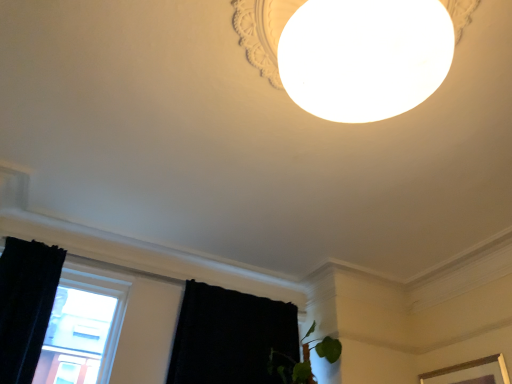
Image resolution: width=512 pixels, height=384 pixels. Describe the element at coordinates (26, 305) in the screenshot. I see `black velvet curtain at left, the first curtain from the left` at that location.

Locate an element on the screen. transparent glass window at lower left is located at coordinates (83, 328).

Is black fabric curtain at lower left, the second curtain positioned from the left, aimed at transparent glass window at lower left?

No, black fabric curtain at lower left, the second curtain positioned from the left, does not turn towards transparent glass window at lower left.

Is black fabric curtain at lower left, the second curtain positioned from the left, in contact with transparent glass window at lower left?

No, black fabric curtain at lower left, the second curtain positioned from the left, is not making contact with transparent glass window at lower left.

Based on the photo, considering the relative positions of black fabric curtain at lower left, the 1th curtain when ordered from right to left, and transparent glass window at lower left in the image provided, is black fabric curtain at lower left, the 1th curtain when ordered from right to left, to the left of transparent glass window at lower left from the viewer's perspective?

No.

Based on the photo, can you tell me how much black fabric curtain at lower left, the 1th curtain when ordered from right to left, and transparent glass window at lower left differ in facing direction?

The angle between the facing direction of black fabric curtain at lower left, the 1th curtain when ordered from right to left, and the facing direction of transparent glass window at lower left is 5.95 degrees.

Considering the positions of objects black velvet curtain at left, the first curtain from the left, and transparent glass window at lower left in the image provided, who is in front, black velvet curtain at left, the first curtain from the left, or transparent glass window at lower left?

black velvet curtain at left, the first curtain from the left, is more forward.

Is black velvet curtain at left, which ranks as the second curtain in right-to-left order, facing away from transparent glass window at lower left?

Yes, black velvet curtain at left, which ranks as the second curtain in right-to-left order, is positioned with its back facing transparent glass window at lower left.

Based on the photo, are black velvet curtain at left, which ranks as the second curtain in right-to-left order, and transparent glass window at lower left making contact?

black velvet curtain at left, which ranks as the second curtain in right-to-left order, and transparent glass window at lower left are clearly separated.

Between black velvet curtain at left, the first curtain from the left, and transparent glass window at lower left, which one has smaller width?

With smaller width is transparent glass window at lower left.

Which object is positioned more to the right, black velvet curtain at left, the first curtain from the left, or black fabric curtain at lower left, the 1th curtain when ordered from right to left?

From the viewer's perspective, black fabric curtain at lower left, the 1th curtain when ordered from right to left, appears more on the right side.

Can you tell me how much black velvet curtain at left, which ranks as the second curtain in right-to-left order, and black fabric curtain at lower left, the second curtain positioned from the left, differ in facing direction?

6.14 degrees separate the facing orientations of black velvet curtain at left, which ranks as the second curtain in right-to-left order, and black fabric curtain at lower left, the second curtain positioned from the left.

Which of these two, black velvet curtain at left, the first curtain from the left, or black fabric curtain at lower left, the second curtain positioned from the left, stands shorter?

black fabric curtain at lower left, the second curtain positioned from the left, is shorter.

What's the angular difference between black fabric curtain at lower left, the second curtain positioned from the left, and black velvet curtain at left, which ranks as the second curtain in right-to-left order,'s facing directions?

black fabric curtain at lower left, the second curtain positioned from the left, and black velvet curtain at left, which ranks as the second curtain in right-to-left order, are facing 6.14 degrees away from each other.

In order to click on curtain above the black fabric curtain at lower left, the 1th curtain when ordered from right to left (from the image's perspective) in this screenshot , I will do `click(26, 305)`.

Based on the photo, in the image, is black fabric curtain at lower left, the 1th curtain when ordered from right to left, on the left side or the right side of black velvet curtain at left, which ranks as the second curtain in right-to-left order?

Based on their positions, black fabric curtain at lower left, the 1th curtain when ordered from right to left, is located to the right of black velvet curtain at left, which ranks as the second curtain in right-to-left order.

Is black fabric curtain at lower left, the 1th curtain when ordered from right to left, oriented away from black velvet curtain at left, which ranks as the second curtain in right-to-left order?

No, black fabric curtain at lower left, the 1th curtain when ordered from right to left, is not facing away from black velvet curtain at left, which ranks as the second curtain in right-to-left order.

Between point (78, 330) and point (10, 266), which one is positioned in front?

The point (10, 266) is in front.

Is transparent glass window at lower left not near black velvet curtain at left, which ranks as the second curtain in right-to-left order?

No, there isn't a large distance between transparent glass window at lower left and black velvet curtain at left, which ranks as the second curtain in right-to-left order.

Which is in front, transparent glass window at lower left or black velvet curtain at left, the first curtain from the left?

black velvet curtain at left, the first curtain from the left.

Which is behind, point (89, 374) or point (225, 335)?

Positioned behind is point (225, 335).

Consider the image. Could you tell me if transparent glass window at lower left is facing black fabric curtain at lower left, the second curtain positioned from the left?

No, transparent glass window at lower left is not aimed at black fabric curtain at lower left, the second curtain positioned from the left.

From their relative heights in the image, would you say transparent glass window at lower left is taller or shorter than black fabric curtain at lower left, the second curtain positioned from the left?

Considering their sizes, transparent glass window at lower left has more height than black fabric curtain at lower left, the second curtain positioned from the left.

Is black fabric curtain at lower left, the 1th curtain when ordered from right to left, surrounded by transparent glass window at lower left?

No.

Image resolution: width=512 pixels, height=384 pixels. I want to click on window on the left of black fabric curtain at lower left, the 1th curtain when ordered from right to left, so click(x=83, y=328).

From a real-world perspective, which curtain is the 1st one above the transparent glass window at lower left? Please provide its 2D coordinates.

[(26, 305)]

When comparing their distances from black velvet curtain at left, the first curtain from the left, does black fabric curtain at lower left, the second curtain positioned from the left, or transparent glass window at lower left seem closer?

The object closer to black velvet curtain at left, the first curtain from the left, is transparent glass window at lower left.

Based on their spatial positions, is transparent glass window at lower left or black fabric curtain at lower left, the 1th curtain when ordered from right to left, further from black velvet curtain at left, the first curtain from the left?

black fabric curtain at lower left, the 1th curtain when ordered from right to left.

Which object lies nearer to the anchor point black fabric curtain at lower left, the second curtain positioned from the left, black velvet curtain at left, the first curtain from the left, or transparent glass window at lower left?

transparent glass window at lower left.

Estimate the real-world distances between objects in this image. Which object is closer to transparent glass window at lower left, black fabric curtain at lower left, the second curtain positioned from the left, or black velvet curtain at left, the first curtain from the left?

black velvet curtain at left, the first curtain from the left, lies closer to transparent glass window at lower left than the other object.

From the image, which object appears to be nearer to black fabric curtain at lower left, the second curtain positioned from the left, transparent glass window at lower left or black velvet curtain at left, which ranks as the second curtain in right-to-left order?

Among the two, transparent glass window at lower left is located nearer to black fabric curtain at lower left, the second curtain positioned from the left.

Estimate the real-world distances between objects in this image. Which object is closer to transparent glass window at lower left, black velvet curtain at left, the first curtain from the left, or black fabric curtain at lower left, the 1th curtain when ordered from right to left?

black velvet curtain at left, the first curtain from the left.

Where is `window situated between black velvet curtain at left, the first curtain from the left, and black fabric curtain at lower left, the 1th curtain when ordered from right to left, from left to right`? window situated between black velvet curtain at left, the first curtain from the left, and black fabric curtain at lower left, the 1th curtain when ordered from right to left, from left to right is located at coordinates (83, 328).